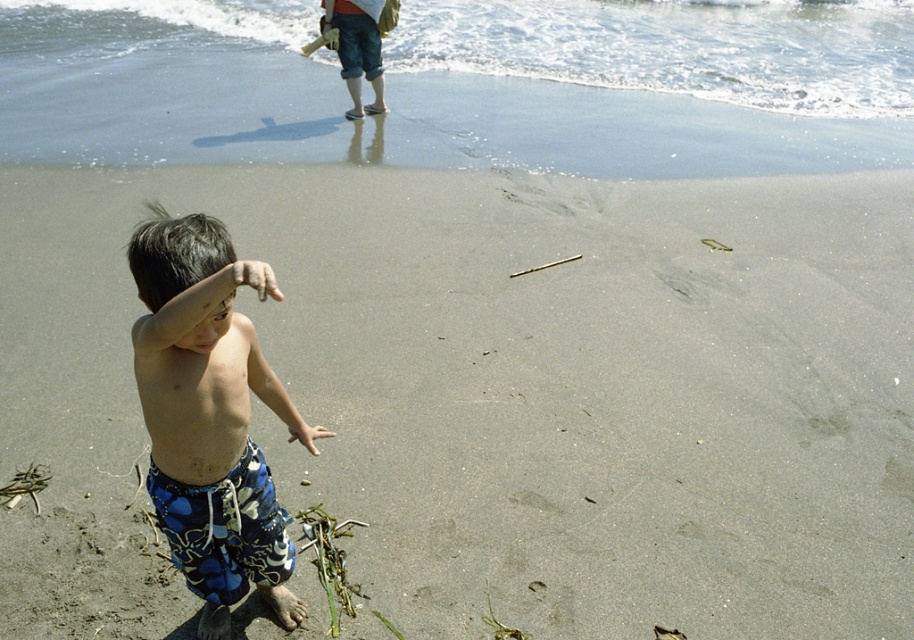
Can you confirm if clear water at upper center is wider than blue printed shorts at lower left?

Yes.

Which of these two, clear water at upper center or blue printed shorts at lower left, stands taller?

clear water at upper center

Where is `clear water at upper center`? Image resolution: width=914 pixels, height=640 pixels. clear water at upper center is located at coordinates (678, 48).

Is smooth sand at lower center above blue printed shorts at lower left?

No, smooth sand at lower center is not above blue printed shorts at lower left.

Is smooth sand at lower center thinner than blue printed shorts at lower left?

In fact, smooth sand at lower center might be wider than blue printed shorts at lower left.

Is point (432, 452) behind point (195, 308)?

Yes, it is behind point (195, 308).

Where is `smooth sand at lower center`? Image resolution: width=914 pixels, height=640 pixels. smooth sand at lower center is located at coordinates (495, 396).

Is point (107, 486) positioned in front of point (575, 4)?

That is True.

Who is more distant from viewer, (x=829, y=515) or (x=599, y=16)?

The point (x=599, y=16) is more distant.

Locate an element on the screen. The image size is (914, 640). smooth sand at lower center is located at coordinates (495, 396).